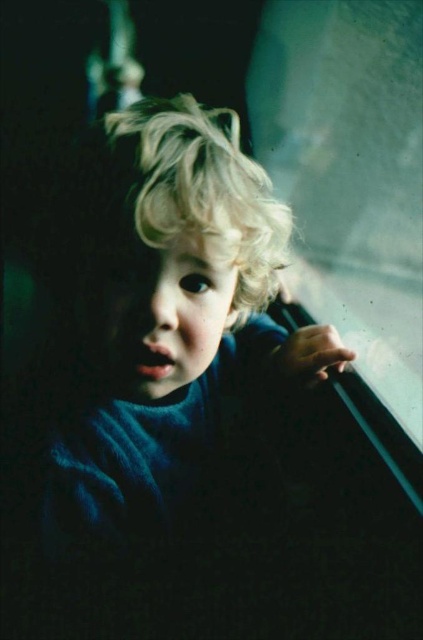
Question: Which of the following is the closest to the observer?

Choices:
 (A) blonde curly hair at center
 (B) transparent glass train window at upper right

Answer: (A)

Question: Which point is farther to the camera?

Choices:
 (A) (173, 116)
 (B) (60, 476)
 (C) (381, 291)

Answer: (C)

Question: Is blue woolen sweater at center positioned in front of transparent glass train window at upper right?

Choices:
 (A) no
 (B) yes

Answer: (B)

Question: Is transparent glass train window at upper right closer to camera compared to blonde curly hair at center?

Choices:
 (A) no
 (B) yes

Answer: (A)

Question: Does blue woolen sweater at center have a lesser width compared to transparent glass train window at upper right?

Choices:
 (A) no
 (B) yes

Answer: (B)

Question: Which of these objects is positioned farthest from the blue woolen sweater at center?

Choices:
 (A) blonde curly hair at center
 (B) transparent glass train window at upper right

Answer: (B)